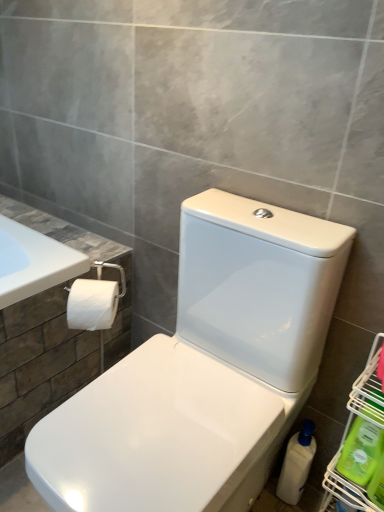
The image size is (384, 512). In order to click on white matte toilet paper at left in this screenshot , I will do `click(92, 304)`.

Identify the location of white glossy toilet at center. The image size is (384, 512). (204, 370).

What do you see at coordinates (361, 451) in the screenshot? I see `green plastic cleaning product at lower right, which appears as the second cleaning product when viewed from the back` at bounding box center [361, 451].

Identify the location of green plastic bottle at lower right, the 3th cleaning product from the back. The image size is (384, 512). pos(378,478).

What are the coordinates of `white plastic bottle at lower right, placed as the first cleaning product when sorted from back to front` in the screenshot? It's located at (297, 464).

At what (x,y) coordinates should I click in order to perform the action: click on white matte toilet paper at left. Please return your answer as a coordinate pair (x, y). The width and height of the screenshot is (384, 512). Looking at the image, I should click on (92, 304).

Is green plastic bottle at lower right, the 3th cleaning product from the back, located outside green plastic cleaning product at lower right, the second cleaning product from the front?

Yes.

Is point (381, 436) in front of point (351, 439)?

Yes, it is.

Can you confirm if green plastic bottle at lower right, which is counted as the first cleaning product, starting from the front, is smaller than green plastic cleaning product at lower right, the second cleaning product from the front?

No, green plastic bottle at lower right, which is counted as the first cleaning product, starting from the front, is not smaller than green plastic cleaning product at lower right, the second cleaning product from the front.

From a real-world perspective, is green plastic bottle at lower right, which is counted as the first cleaning product, starting from the front, positioned above or below green plastic cleaning product at lower right, which appears as the second cleaning product when viewed from the back?

From a real-world perspective, green plastic bottle at lower right, which is counted as the first cleaning product, starting from the front, is physically above green plastic cleaning product at lower right, which appears as the second cleaning product when viewed from the back.

From a real-world perspective, is white plastic bottle at lower right, the third cleaning product viewed from the front, on white glossy toilet at center?

No, from a real-world perspective, white plastic bottle at lower right, the third cleaning product viewed from the front, is not on top of white glossy toilet at center.

Is white plastic bottle at lower right, the third cleaning product viewed from the front, in contact with white glossy toilet at center?

There is a gap between white plastic bottle at lower right, the third cleaning product viewed from the front, and white glossy toilet at center.

In the image, is white plastic bottle at lower right, the third cleaning product viewed from the front, on the left side or the right side of white glossy toilet at center?

From the image, it's evident that white plastic bottle at lower right, the third cleaning product viewed from the front, is to the right of white glossy toilet at center.

Is point (288, 474) farther from camera compared to point (152, 341)?

Yes.

Which object is thinner, white matte toilet paper at left or green plastic cleaning product at lower right, the second cleaning product from the front?

Thinner between the two is green plastic cleaning product at lower right, the second cleaning product from the front.

Is white matte toilet paper at left next to green plastic cleaning product at lower right, which appears as the second cleaning product when viewed from the back, and touching it?

white matte toilet paper at left is not next to green plastic cleaning product at lower right, which appears as the second cleaning product when viewed from the back, and they're not touching.

From the image's perspective, would you say white matte toilet paper at left is shown under green plastic cleaning product at lower right, which appears as the second cleaning product when viewed from the back?

Actually, white matte toilet paper at left appears above green plastic cleaning product at lower right, which appears as the second cleaning product when viewed from the back, in the image.

Does point (73, 287) appear closer or farther from the camera than point (345, 457)?

Point (73, 287) is positioned farther from the camera compared to point (345, 457).

Is white glossy toilet at center touching white matte toilet paper at left?

No, white glossy toilet at center is not making contact with white matte toilet paper at left.

Between white glossy toilet at center and white matte toilet paper at left, which one appears on the right side from the viewer's perspective?

Positioned to the right is white glossy toilet at center.

Is white glossy toilet at center thinner than white matte toilet paper at left?

In fact, white glossy toilet at center might be wider than white matte toilet paper at left.

Is white glossy toilet at center positioned with its back to white matte toilet paper at left?

No.

Is green plastic cleaning product at lower right, the second cleaning product from the front, far away from white glossy toilet at center?

No.

Is green plastic cleaning product at lower right, which appears as the second cleaning product when viewed from the back, positioned beyond the bounds of white glossy toilet at center?

That's correct, green plastic cleaning product at lower right, which appears as the second cleaning product when viewed from the back, is outside of white glossy toilet at center.

Is green plastic cleaning product at lower right, which appears as the second cleaning product when viewed from the back, wider than white glossy toilet at center?

No, green plastic cleaning product at lower right, which appears as the second cleaning product when viewed from the back, is not wider than white glossy toilet at center.

Can you confirm if white glossy toilet at center is shorter than green plastic cleaning product at lower right, which appears as the second cleaning product when viewed from the back?

No.

Identify the location of toilet that appears above the green plastic cleaning product at lower right, the second cleaning product from the front (from a real-world perspective). (204, 370).

Which of these two, white glossy toilet at center or green plastic cleaning product at lower right, the second cleaning product from the front, is smaller?

green plastic cleaning product at lower right, the second cleaning product from the front.

Is green plastic cleaning product at lower right, which appears as the second cleaning product when viewed from the back, completely or partially inside white glossy toilet at center?

No.

Considering the relative positions of green plastic bottle at lower right, which is counted as the first cleaning product, starting from the front, and white glossy toilet at center in the image provided, is green plastic bottle at lower right, which is counted as the first cleaning product, starting from the front, to the right of white glossy toilet at center from the viewer's perspective?

Yes, green plastic bottle at lower right, which is counted as the first cleaning product, starting from the front, is to the right of white glossy toilet at center.

From a real-world perspective, which object stands above the other?

white glossy toilet at center.

Is green plastic bottle at lower right, which is counted as the first cleaning product, starting from the front, not inside white glossy toilet at center?

green plastic bottle at lower right, which is counted as the first cleaning product, starting from the front, lies outside white glossy toilet at center's area.

Between green plastic bottle at lower right, which is counted as the first cleaning product, starting from the front, and white glossy toilet at center, which one has more height?

With more height is white glossy toilet at center.

Locate an element on the screen. This screenshot has height=512, width=384. cleaning product located on the right of green plastic cleaning product at lower right, the second cleaning product from the front is located at coordinates (378, 478).

Find the location of a particular element. This screenshot has width=384, height=512. toilet positioned vertically above the white plastic bottle at lower right, placed as the first cleaning product when sorted from back to front (from a real-world perspective) is located at coordinates (204, 370).

When comparing their distances from green plastic cleaning product at lower right, which appears as the second cleaning product when viewed from the back, does white matte toilet paper at left or white glossy toilet at center seem closer?

white glossy toilet at center.

Estimate the real-world distances between objects in this image. Which object is closer to white glossy toilet at center, green plastic cleaning product at lower right, the second cleaning product from the front, or white matte toilet paper at left?

white matte toilet paper at left is closer to white glossy toilet at center.

Consider the image. Based on their spatial positions, is white plastic bottle at lower right, placed as the first cleaning product when sorted from back to front, or green plastic cleaning product at lower right, which appears as the second cleaning product when viewed from the back, closer to green plastic bottle at lower right, which is counted as the first cleaning product, starting from the front?

green plastic cleaning product at lower right, which appears as the second cleaning product when viewed from the back, is positioned closer to the anchor green plastic bottle at lower right, which is counted as the first cleaning product, starting from the front.

From the image, which object appears to be farther from white plastic bottle at lower right, placed as the first cleaning product when sorted from back to front, green plastic cleaning product at lower right, which appears as the second cleaning product when viewed from the back, or white glossy toilet at center?

white glossy toilet at center is positioned further to the anchor white plastic bottle at lower right, placed as the first cleaning product when sorted from back to front.

When comparing their distances from white matte toilet paper at left, does green plastic cleaning product at lower right, which appears as the second cleaning product when viewed from the back, or white glossy toilet at center seem closer?

white glossy toilet at center.

When comparing their distances from white plastic bottle at lower right, the third cleaning product viewed from the front, does white glossy toilet at center or white matte toilet paper at left seem further?

Among the two, white matte toilet paper at left is located further to white plastic bottle at lower right, the third cleaning product viewed from the front.

Looking at the image, which one is located closer to green plastic cleaning product at lower right, the second cleaning product from the front, green plastic bottle at lower right, which is counted as the first cleaning product, starting from the front, or white plastic bottle at lower right, the third cleaning product viewed from the front?

The object closer to green plastic cleaning product at lower right, the second cleaning product from the front, is green plastic bottle at lower right, which is counted as the first cleaning product, starting from the front.

Looking at this image, which object lies nearer to the anchor point white matte toilet paper at left, white glossy toilet at center or green plastic cleaning product at lower right, which appears as the second cleaning product when viewed from the back?

The object closer to white matte toilet paper at left is white glossy toilet at center.

Locate an element on the screen. The width and height of the screenshot is (384, 512). cleaning product between green plastic bottle at lower right, the 3th cleaning product from the back, and white plastic bottle at lower right, placed as the first cleaning product when sorted from back to front, in the front-back direction is located at coordinates [x=361, y=451].

Locate an element on the screen. This screenshot has width=384, height=512. toilet between white matte toilet paper at left and green plastic cleaning product at lower right, the second cleaning product from the front, from left to right is located at coordinates (204, 370).

Identify the location of toilet paper between white glossy toilet at center and white plastic bottle at lower right, placed as the first cleaning product when sorted from back to front, in the front-back direction. (92, 304).

This screenshot has width=384, height=512. What are the coordinates of `cleaning product between white matte toilet paper at left and green plastic cleaning product at lower right, which appears as the second cleaning product when viewed from the back, from left to right` in the screenshot? It's located at (297, 464).